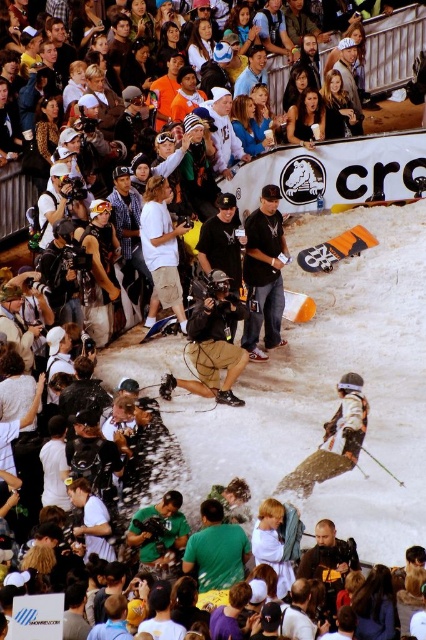
Does white matte snowboard at center have a smaller size compared to black matte cap at center?

Indeed, white matte snowboard at center has a smaller size compared to black matte cap at center.

Image resolution: width=426 pixels, height=640 pixels. What do you see at coordinates (334, 440) in the screenshot? I see `white matte snowboard at center` at bounding box center [334, 440].

Locate an element on the screen. The width and height of the screenshot is (426, 640). white matte snowboard at center is located at coordinates (334, 440).

In the scene shown: Is black cotton shirt at center positioned behind green fabric shirt at center?

Yes, it is behind green fabric shirt at center.

The height and width of the screenshot is (640, 426). Describe the element at coordinates (264, 275) in the screenshot. I see `black cotton shirt at center` at that location.

I want to click on black cotton shirt at center, so click(x=264, y=275).

Between point (215, 516) and point (207, 257), which one is positioned in front?

Positioned in front is point (215, 516).

Does green matte shirt at center come behind black matte cap at center?

No, green matte shirt at center is in front of black matte cap at center.

Identify the location of green matte shirt at center. (215, 556).

This screenshot has height=640, width=426. I want to click on green matte shirt at center, so click(215, 556).